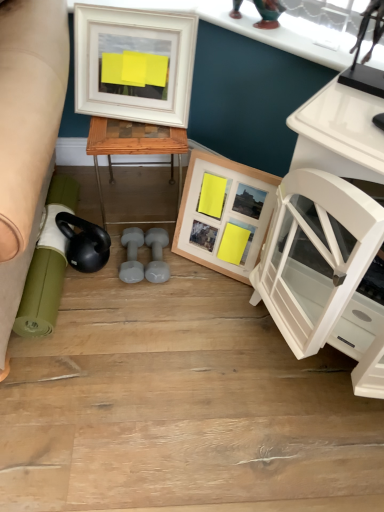
At what (x,y) coordinates should I click in order to perform the action: click on vacant area that is in front of wooden picture frame at center, marked as the 1th picture frame in a right-to-left arrangement. Please return your answer as a coordinate pair (x, y). This screenshot has height=512, width=384. Looking at the image, I should click on (215, 304).